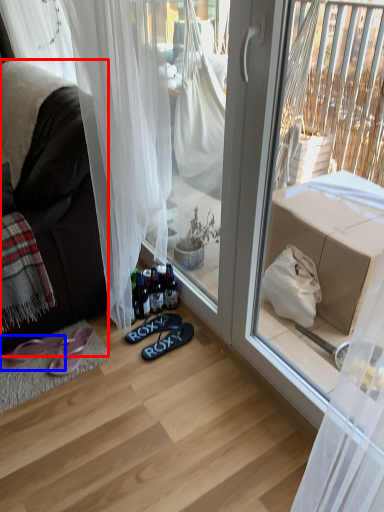
Question: Among these objects, which one is farthest to the camera, studio couch (highlighted by a red box) or footwear (highlighted by a blue box)?

Choices:
 (A) studio couch
 (B) footwear

Answer: (B)